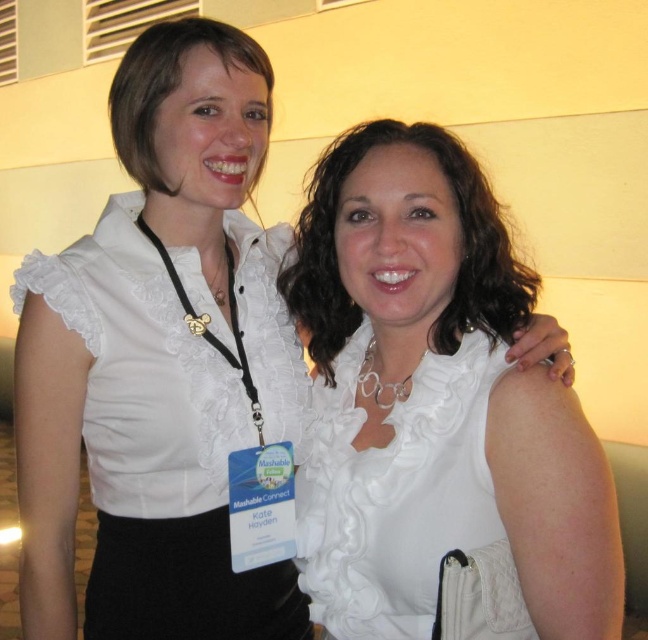
Who is positioned more to the left, white satin blouse at center or white satin dress at center?

white satin blouse at center

Who is positioned more to the right, white satin blouse at center or white satin dress at center?

white satin dress at center is more to the right.

Between point (446, 296) and point (518, 612), which one is positioned in front?

Point (518, 612) is in front.

I want to click on white satin blouse at center, so click(435, 410).

Is white satin blouse at upper left positioned behind white satin dress at center?

Yes, white satin blouse at upper left is behind white satin dress at center.

Which is in front, point (205, 500) or point (406, 522)?

Point (406, 522) is in front.

Locate an element on the screen. This screenshot has height=640, width=648. white satin blouse at upper left is located at coordinates (154, 436).

Which of these two, white satin blouse at center or white satin blouse at upper left, stands shorter?

With less height is white satin blouse at upper left.

Is white satin blouse at center thinner than white satin blouse at upper left?

Correct, white satin blouse at center's width is less than white satin blouse at upper left's.

What do you see at coordinates (435, 410) in the screenshot? I see `white satin blouse at center` at bounding box center [435, 410].

Find the location of `white satin blouse at center`. white satin blouse at center is located at coordinates (435, 410).